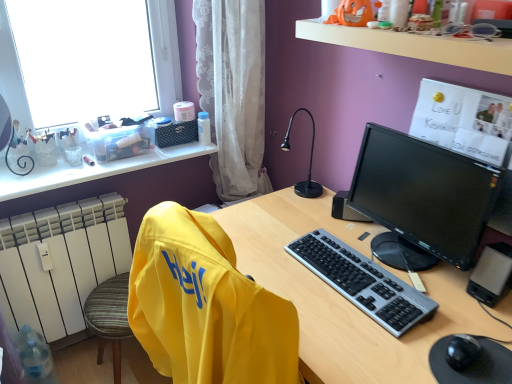
Question: Would you say white lace curtain at center is outside black glossy monitor at center right?

Choices:
 (A) no
 (B) yes

Answer: (B)

Question: Does white lace curtain at center have a lesser width compared to black glossy monitor at center right?

Choices:
 (A) yes
 (B) no

Answer: (B)

Question: Can you confirm if white lace curtain at center is wider than black glossy monitor at center right?

Choices:
 (A) no
 (B) yes

Answer: (B)

Question: Is the depth of white lace curtain at center less than that of black glossy monitor at center right?

Choices:
 (A) no
 (B) yes

Answer: (A)

Question: Is white lace curtain at center turned away from black glossy monitor at center right?

Choices:
 (A) no
 (B) yes

Answer: (A)

Question: Is white lace curtain at center to the left of black glossy monitor at center right from the viewer's perspective?

Choices:
 (A) yes
 (B) no

Answer: (A)

Question: Would you say yellow fabric swivel chair at left is part of black glossy monitor at center right's contents?

Choices:
 (A) no
 (B) yes

Answer: (A)

Question: Considering the relative sizes of black glossy monitor at center right and yellow fabric swivel chair at left in the image provided, is black glossy monitor at center right bigger than yellow fabric swivel chair at left?

Choices:
 (A) no
 (B) yes

Answer: (A)

Question: Is black glossy monitor at center right positioned in front of yellow fabric swivel chair at left?

Choices:
 (A) no
 (B) yes

Answer: (A)

Question: Considering the relative sizes of black glossy monitor at center right and yellow fabric swivel chair at left in the image provided, is black glossy monitor at center right smaller than yellow fabric swivel chair at left?

Choices:
 (A) no
 (B) yes

Answer: (B)

Question: From a real-world perspective, is black glossy monitor at center right on yellow fabric swivel chair at left?

Choices:
 (A) no
 (B) yes

Answer: (B)

Question: Is black glossy monitor at center right oriented away from yellow fabric swivel chair at left?

Choices:
 (A) yes
 (B) no

Answer: (B)

Question: From the image's perspective, does white lace curtain at center appear lower than yellow fabric swivel chair at left?

Choices:
 (A) yes
 (B) no

Answer: (B)